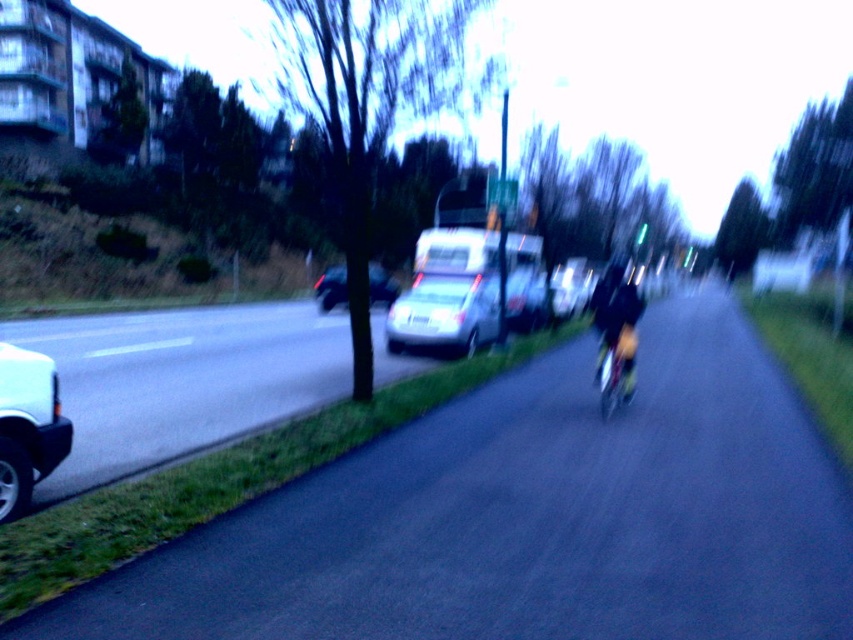
Does metallic silver van at center have a lesser width compared to shiny blue bicycle at center-right?

No.

Between metallic silver van at center and shiny blue bicycle at center-right, which one appears on the right side from the viewer's perspective?

metallic silver van at center

Which is behind, point (515, 304) or point (618, 353)?

The point (515, 304) is more distant.

The image size is (853, 640). In order to click on metallic silver van at center in this screenshot , I will do `click(537, 304)`.

Is point (26, 465) behind point (341, 269)?

No, it is in front of (341, 269).

Between point (22, 349) and point (387, 289), which one is positioned in front?

Point (22, 349) is more forward.

Which is in front, point (39, 454) or point (393, 284)?

Point (39, 454) is in front.

Find the location of a particular element. white matte car at left is located at coordinates (27, 426).

Between satin silver sedan at center and shiny blue bicycle at center-right, which one is positioned higher?

satin silver sedan at center is higher up.

Who is lower down, satin silver sedan at center or shiny blue bicycle at center-right?

shiny blue bicycle at center-right is lower down.

Which is behind, point (444, 276) or point (608, 384)?

The point (444, 276) is more distant.

The width and height of the screenshot is (853, 640). I want to click on satin silver sedan at center, so click(x=444, y=312).